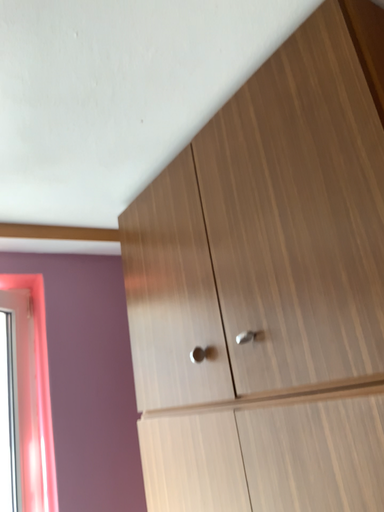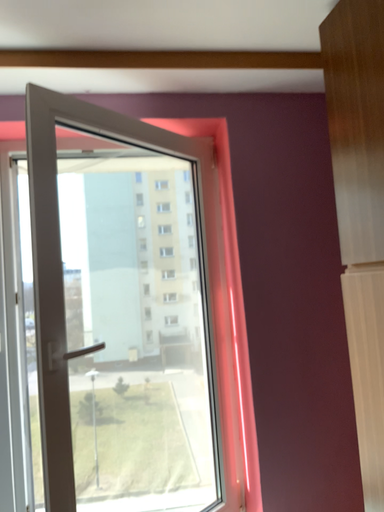
Question: How did the camera likely rotate when shooting the video?

Choices:
 (A) rotated left
 (B) rotated right

Answer: (A)